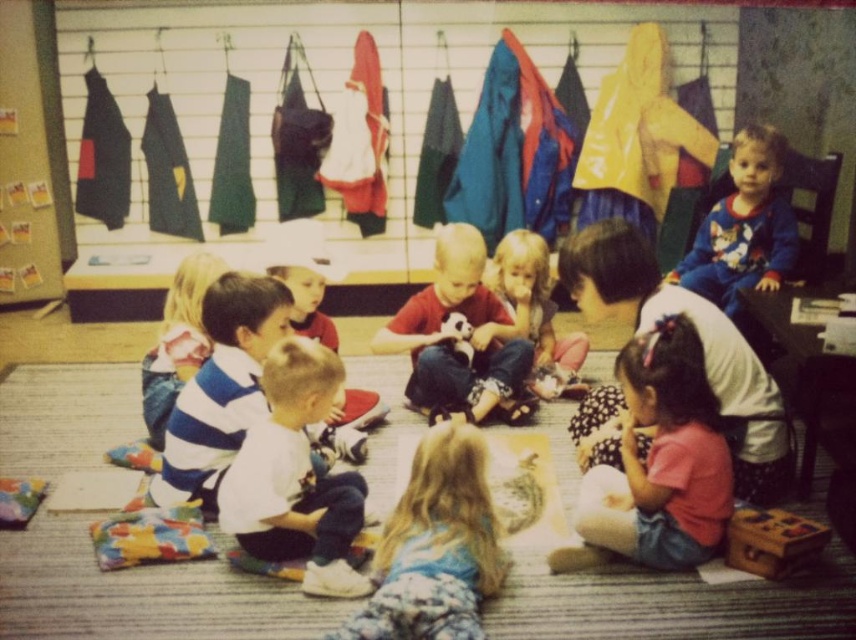
Question: Does white striped shirt at center have a greater width compared to wooden toy at lower right?

Choices:
 (A) yes
 (B) no

Answer: (A)

Question: Can you confirm if textured fabric jackets at upper center is thinner than pink cotton shirt at lower center?

Choices:
 (A) no
 (B) yes

Answer: (A)

Question: Among these objects, which one is farthest from the camera?

Choices:
 (A) wooden toy at lower right
 (B) white cotton shirt at center
 (C) printed cotton pajamas at upper right

Answer: (C)

Question: Among these points, which one is nearest to the camera?

Choices:
 (A) (581, 262)
 (B) (498, 278)
 (C) (720, 259)
 (D) (278, 333)

Answer: (A)

Question: Is textured fabric jackets at upper center bigger than printed cotton pajamas at upper right?

Choices:
 (A) no
 (B) yes

Answer: (B)

Question: Which point is farther to the camera?

Choices:
 (A) (289, 440)
 (B) (782, 417)
 (C) (467, 356)
 (D) (161, 52)

Answer: (D)